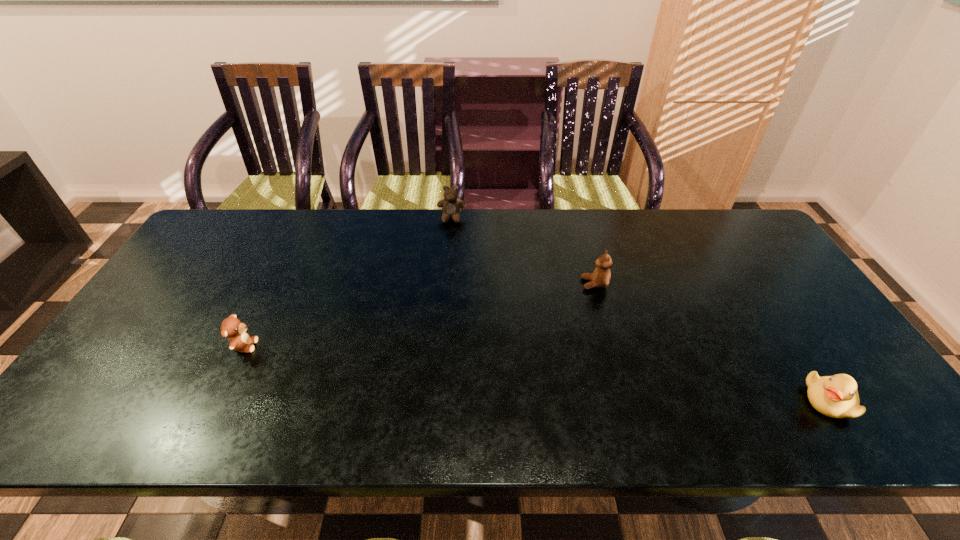
Find the location of a particular element. The height and width of the screenshot is (540, 960). vacant space at the far edge is located at coordinates (616, 249).

You are a GUI agent. You are given a task and a screenshot of the screen. Output one action in this format:
    pyautogui.click(x=<x>, y=<y>)
    Task: Click on the free space at the near edge
    
    Given the screenshot: What is the action you would take?
    pyautogui.click(x=654, y=403)

In the image, there is a desktop. Identify the location of vacant space at the right edge. (782, 330).

This screenshot has width=960, height=540. I want to click on free location at the far left corner, so click(240, 251).

Locate an element on the screen. The width and height of the screenshot is (960, 540). free space between the third object from left to right and the farthest object is located at coordinates (523, 251).

Find the location of a particular element. free space between the nearest teddy bear and the second teddy bear from right to left is located at coordinates (348, 282).

Identify the location of blank region between the third nearest object and the rightmost object. The height and width of the screenshot is (540, 960). (712, 342).

Find the location of a particular element. This screenshot has width=960, height=540. vacant point located between the farthest teddy bear and the third farthest object is located at coordinates (348, 282).

Locate an element on the screen. The height and width of the screenshot is (540, 960). vacant area between the rightmost object and the nearest teddy bear is located at coordinates (537, 373).

I want to click on free point between the duckling and the second nearest object, so click(537, 373).